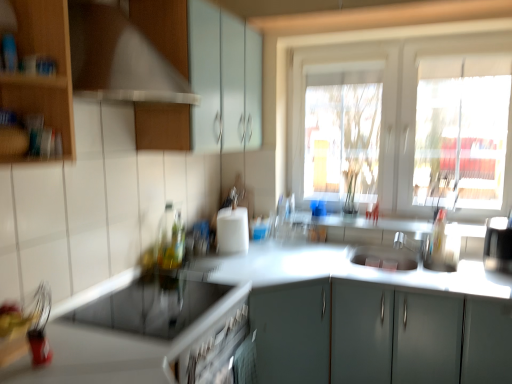
This screenshot has width=512, height=384. Identify the location of vacant space to the right of translucent glass bottle at center, acting as the 2th bottle starting from the front. pos(206,261).